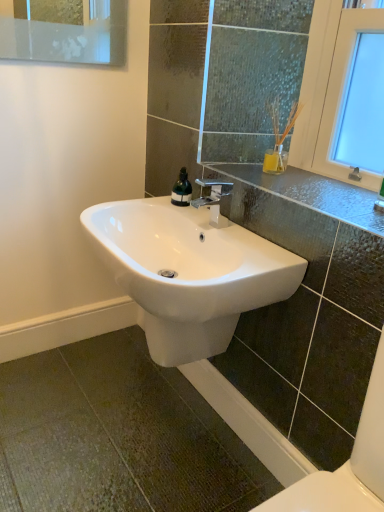
Question: Is polished chrome faucet at center bigger than glossy ceramic sink at center?

Choices:
 (A) no
 (B) yes

Answer: (A)

Question: Are polished chrome faucet at center and glossy ceramic sink at center beside each other?

Choices:
 (A) yes
 (B) no

Answer: (B)

Question: Is polished chrome faucet at center outside of glossy ceramic sink at center?

Choices:
 (A) no
 (B) yes

Answer: (B)

Question: Considering the relative sizes of polished chrome faucet at center and glossy ceramic sink at center in the image provided, is polished chrome faucet at center taller than glossy ceramic sink at center?

Choices:
 (A) no
 (B) yes

Answer: (B)

Question: Considering the relative positions of polished chrome faucet at center and glossy ceramic sink at center in the image provided, is polished chrome faucet at center to the right of glossy ceramic sink at center from the viewer's perspective?

Choices:
 (A) yes
 (B) no

Answer: (B)

Question: From a real-world perspective, is polished chrome faucet at center positioned under glossy ceramic sink at center based on gravity?

Choices:
 (A) yes
 (B) no

Answer: (A)

Question: From the image's perspective, is polished chrome faucet at center under white glossy sink at center?

Choices:
 (A) no
 (B) yes

Answer: (A)

Question: Would you say polished chrome faucet at center is outside white glossy sink at center?

Choices:
 (A) yes
 (B) no

Answer: (A)

Question: Is polished chrome faucet at center shorter than white glossy sink at center?

Choices:
 (A) no
 (B) yes

Answer: (B)

Question: Is polished chrome faucet at center bigger than white glossy sink at center?

Choices:
 (A) no
 (B) yes

Answer: (A)

Question: Considering the relative sizes of polished chrome faucet at center and white glossy sink at center in the image provided, is polished chrome faucet at center smaller than white glossy sink at center?

Choices:
 (A) no
 (B) yes

Answer: (B)

Question: Is polished chrome faucet at center facing towards white glossy sink at center?

Choices:
 (A) yes
 (B) no

Answer: (B)

Question: Would you say glossy ceramic sink at center is a long distance from polished chrome faucet at center?

Choices:
 (A) yes
 (B) no

Answer: (B)